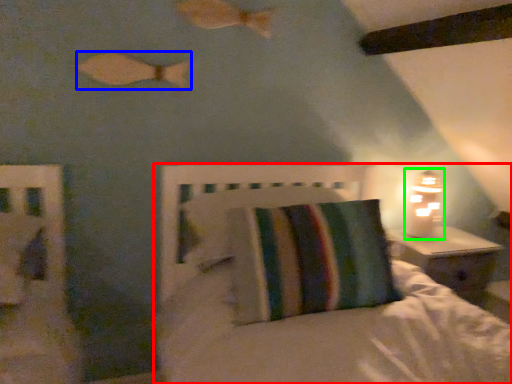
Question: Estimate the real-world distances between objects in this image. Which object is closer to bed (highlighted by a red box), fish (highlighted by a blue box) or table lamp (highlighted by a green box)?

Choices:
 (A) fish
 (B) table lamp

Answer: (B)